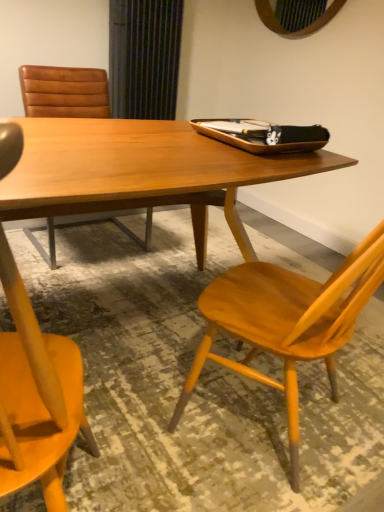
What is the approximate width of brown leather chair at upper left, acting as the second chair starting from the right?

The width of brown leather chair at upper left, acting as the second chair starting from the right, is 65.15 centimeters.

What do you see at coordinates (287, 322) in the screenshot? This screenshot has width=384, height=512. I see `wooden chair at right, the second chair in the back-to-front sequence` at bounding box center [287, 322].

In order to click on brown leather chair at upper left, the 1th chair positioned from the back in this screenshot , I will do `click(64, 92)`.

Could you tell me if brown leather chair at upper left, acting as the second chair starting from the right, is turned towards wooden table at center?

Yes.

From a real-world perspective, is brown leather chair at upper left, acting as the second chair starting from the right, positioned above or below wooden table at center?

brown leather chair at upper left, acting as the second chair starting from the right, is above wooden table at center.

Considering the relative sizes of brown leather chair at upper left, acting as the second chair starting from the right, and wooden table at center in the image provided, is brown leather chair at upper left, acting as the second chair starting from the right, shorter than wooden table at center?

In fact, brown leather chair at upper left, acting as the second chair starting from the right, may be taller than wooden table at center.

Would you say brown leather chair at upper left, acting as the second chair starting from the right, is inside or outside wooden table at center?

brown leather chair at upper left, acting as the second chair starting from the right, exists outside the volume of wooden table at center.

From the image's perspective, which object appears higher, wooden chair at right, which is the 1th chair from front to back, or brown leather chair at upper left, the 1th chair positioned from the back?

brown leather chair at upper left, the 1th chair positioned from the back.

Is point (378, 245) closer or farther from the camera than point (65, 68)?

Point (378, 245) is closer to the camera than point (65, 68).

Where is `chair located above the brown leather chair at upper left, acting as the second chair starting from the right (from a real-world perspective)`? The width and height of the screenshot is (384, 512). chair located above the brown leather chair at upper left, acting as the second chair starting from the right (from a real-world perspective) is located at coordinates (287, 322).

Is brown leather chair at upper left, acting as the second chair starting from the right, at the back of wooden chair at right, which is the 1th chair from front to back?

wooden chair at right, which is the 1th chair from front to back, is not turned away from brown leather chair at upper left, acting as the second chair starting from the right.

In the image, is wooden chair at right, which is the 1th chair from front to back, positioned in front of or behind wooden table at center?

wooden chair at right, which is the 1th chair from front to back, is positioned closer to the viewer than wooden table at center.

From a real-world perspective, does wooden chair at right, which appears as the 2th chair when viewed from the left, stand above wooden table at center?

Yes, from a real-world perspective, wooden chair at right, which appears as the 2th chair when viewed from the left, is above wooden table at center.

Which object is positioned more to the left, wooden chair at right, which is the 1th chair from front to back, or wooden table at center?

wooden table at center is more to the left.

At what (x,y) coordinates should I click in order to perform the action: click on chair below the wooden table at center (from the image's perspective). Please return your answer as a coordinate pair (x, y). The image size is (384, 512). Looking at the image, I should click on click(x=287, y=322).

Could wooden chair at right, the second chair in the back-to-front sequence, be considered to be inside brown leather chair at upper left, which appears as the second chair when viewed from the front?

No, brown leather chair at upper left, which appears as the second chair when viewed from the front, does not contain wooden chair at right, the second chair in the back-to-front sequence.

Is brown leather chair at upper left, which is the 1th chair in left-to-right order, shorter than wooden chair at right, the second chair in the back-to-front sequence?

Yes, brown leather chair at upper left, which is the 1th chair in left-to-right order, is shorter than wooden chair at right, the second chair in the back-to-front sequence.

Is brown leather chair at upper left, acting as the second chair starting from the right, thinner than wooden chair at right, which is the 1th chair from front to back?

No, brown leather chair at upper left, acting as the second chair starting from the right, is not thinner than wooden chair at right, which is the 1th chair from front to back.

Which is in front, wooden table at center or wooden chair at right, the 1th chair viewed from the right?

wooden chair at right, the 1th chair viewed from the right, is closer to the camera.

Can you confirm if wooden table at center is taller than wooden chair at right, which appears as the 2th chair when viewed from the left?

Incorrect, the height of wooden table at center is not larger of that of wooden chair at right, which appears as the 2th chair when viewed from the left.

From the image's perspective, between wooden table at center and wooden chair at right, the second chair in the back-to-front sequence, who is located below?

wooden chair at right, the second chair in the back-to-front sequence, from the image's perspective.

What's the angular difference between wooden table at center and wooden chair at right, the second chair in the back-to-front sequence,'s facing directions?

wooden table at center and wooden chair at right, the second chair in the back-to-front sequence, are facing 156 degrees away from each other.

Is wooden table at center located outside brown leather chair at upper left, which is the 1th chair in left-to-right order?

Yes, wooden table at center is located beyond the bounds of brown leather chair at upper left, which is the 1th chair in left-to-right order.

From a real-world perspective, between wooden table at center and brown leather chair at upper left, the 1th chair positioned from the back, who is vertically higher?

From a 3D spatial view, brown leather chair at upper left, the 1th chair positioned from the back, is above.

Considering the sizes of objects wooden table at center and brown leather chair at upper left, acting as the second chair starting from the right, in the image provided, who is bigger, wooden table at center or brown leather chair at upper left, acting as the second chair starting from the right,?

Bigger between the two is wooden table at center.

What's the angular difference between wooden table at center and brown leather chair at upper left, which is the 1th chair in left-to-right order,'s facing directions?

They differ by 1.28 degrees in their facing directions.

Identify the location of chair behind the wooden table at center. (64, 92).

Locate an element on the screen. This screenshot has height=512, width=384. chair below the brown leather chair at upper left, which appears as the second chair when viewed from the front (from the image's perspective) is located at coordinates (287, 322).

Considering their positions, is wooden chair at right, the second chair in the back-to-front sequence, positioned closer to wooden table at center than brown leather chair at upper left, which is the 1th chair in left-to-right order?

Based on the image, wooden chair at right, the second chair in the back-to-front sequence, appears to be nearer to wooden table at center.

Considering their positions, is brown leather chair at upper left, which appears as the second chair when viewed from the front, positioned closer to wooden table at center than wooden chair at right, which is the 1th chair from front to back?

wooden chair at right, which is the 1th chair from front to back, is positioned closer to the anchor wooden table at center.

From the image, which object appears to be farther from wooden chair at right, which appears as the 2th chair when viewed from the left, brown leather chair at upper left, which appears as the second chair when viewed from the front, or wooden table at center?

brown leather chair at upper left, which appears as the second chair when viewed from the front, lies further to wooden chair at right, which appears as the 2th chair when viewed from the left, than the other object.

Consider the image. From the image, which object appears to be farther from wooden chair at right, which is the 1th chair from front to back, wooden table at center or brown leather chair at upper left, acting as the second chair starting from the right?

brown leather chair at upper left, acting as the second chair starting from the right.

Considering their positions, is wooden chair at right, the second chair in the back-to-front sequence, positioned closer to brown leather chair at upper left, which appears as the second chair when viewed from the front, than wooden table at center?

The object closer to brown leather chair at upper left, which appears as the second chair when viewed from the front, is wooden table at center.

Considering their positions, is wooden table at center positioned closer to brown leather chair at upper left, which is the 1th chair in left-to-right order, than wooden chair at right, which is the 1th chair from front to back?

wooden table at center.

Find the location of a particular element. This screenshot has width=384, height=512. round table between wooden chair at right, which is the 1th chair from front to back, and brown leather chair at upper left, acting as the second chair starting from the right, in the front-back direction is located at coordinates (117, 194).